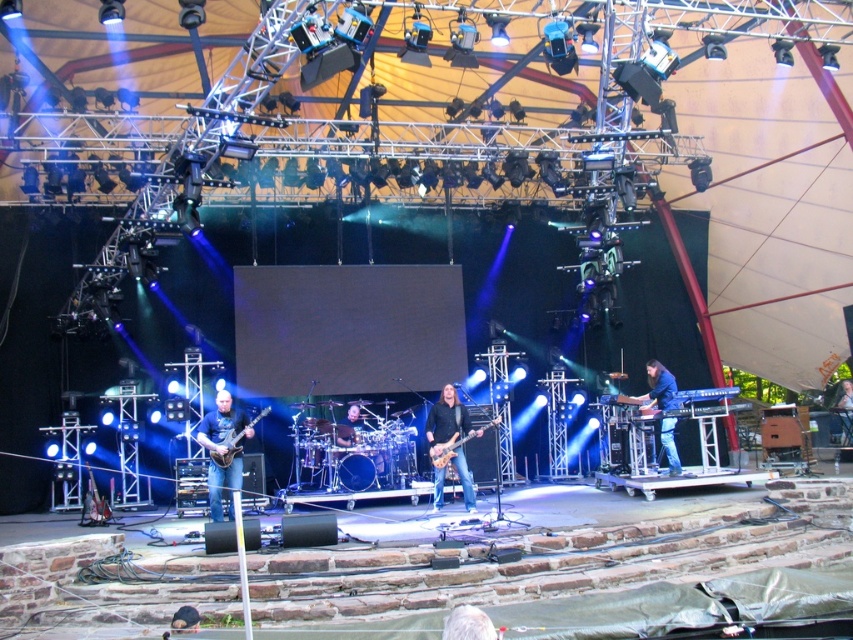
Question: Is blue denim jeans at lower right further to the viewer compared to white fabric shirt at center?

Choices:
 (A) yes
 (B) no

Answer: (B)

Question: Which object is the farthest from the white fabric shirt at center?

Choices:
 (A) blue denim jeans at lower right
 (B) gray hair at lower center
 (C) matte black guitar at center

Answer: (B)

Question: Which point is farther to the camera?

Choices:
 (A) matte black guitar at center
 (B) dark blue jeans at lower center
 (C) black leather jacket at center

Answer: (C)

Question: Observing the image, what is the correct spatial positioning of glossy wood electric guitar at center in reference to white fabric shirt at center?

Choices:
 (A) below
 (B) above

Answer: (A)

Question: Which point is farther to the camera?

Choices:
 (A) (212, 436)
 (B) (670, 442)

Answer: (B)

Question: Can you confirm if white fabric shirt at center is smaller than dark blue jeans at lower center?

Choices:
 (A) no
 (B) yes

Answer: (A)